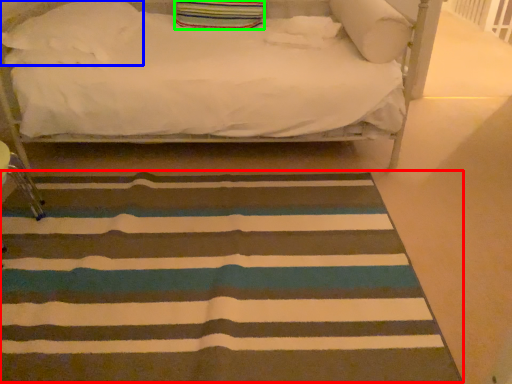
Question: Based on their relative distances, which object is farther from mat (highlighted by a red box)? Choose from pillow (highlighted by a blue box) and pillow (highlighted by a green box).

Choices:
 (A) pillow
 (B) pillow

Answer: (B)